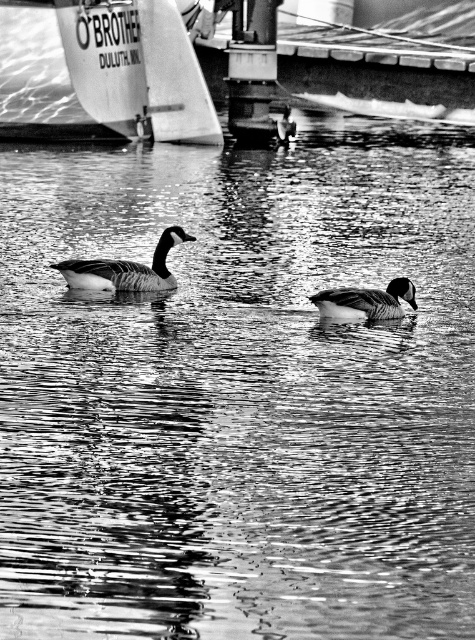
You are a photographer trying to capture the dark gray matte duck at center without the white sailboat at upper left blocking it. Is the sailboat closer to you or farther away than the duck?

The white sailboat at upper left is further to the viewer than the dark gray matte duck at center, so the sailboat is closer to you and might block the view of the duck.

You are a wildlife photographer aiming to capture both the dark gray matte duck at center and the smooth gray duck at center in a single shot. Given their widths, which duck would require you to zoom out more to ensure it fits entirely in the frame?

The dark gray matte duck at center has a greater width than the smooth gray duck at center, so you would need to zoom out more to capture the dark gray matte duck at center in its entirety.